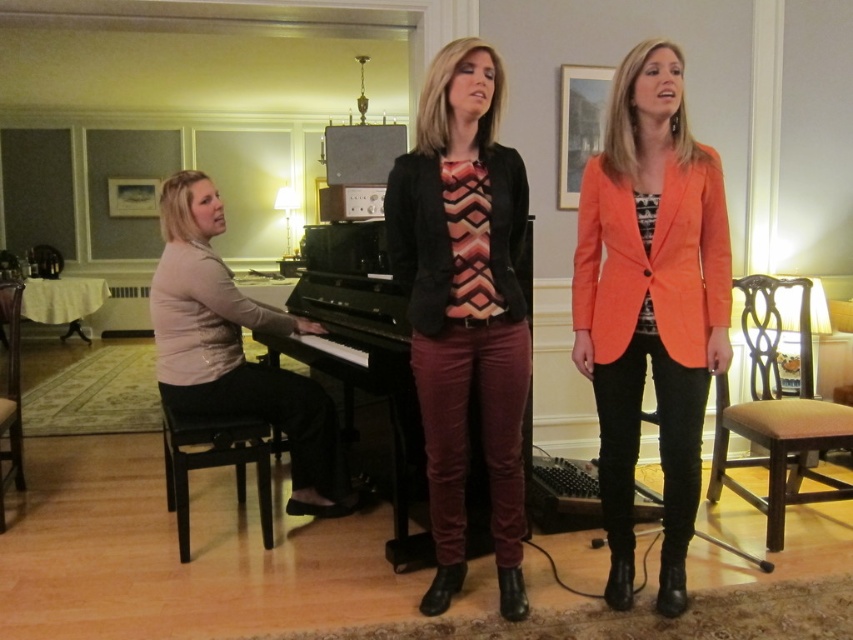
Question: Considering the real-world distances, which object is farthest from the orange fabric blazer at center?

Choices:
 (A) black wood stool at lower left
 (B) black polished piano at center
 (C) geometric patterned fabric tie at center

Answer: (A)

Question: Can you confirm if velvet maroon pants at center is positioned to the right of black polished piano at center?

Choices:
 (A) no
 (B) yes

Answer: (B)

Question: Among these points, which one is nearest to the camera?

Choices:
 (A) (476, 195)
 (B) (236, 432)
 (C) (674, 227)

Answer: (C)

Question: Which point is farther to the camera?

Choices:
 (A) black polished piano at center
 (B) velvet maroon pants at center
 (C) geometric patterned fabric tie at center

Answer: (A)

Question: Is velvet maroon pants at center to the left of matte beige sweater at left from the viewer's perspective?

Choices:
 (A) no
 (B) yes

Answer: (A)

Question: In this image, where is orange fabric blazer at center located relative to velvet maroon pants at center?

Choices:
 (A) below
 (B) above

Answer: (B)